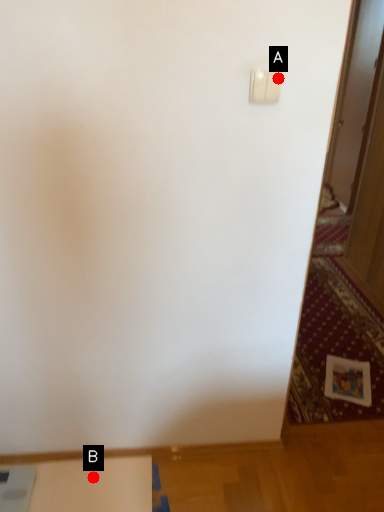
Question: Two points are circled on the image, labeled by A and B beside each circle. Which point is closer to the camera taking this photo?

Choices:
 (A) A is closer
 (B) B is closer

Answer: (A)